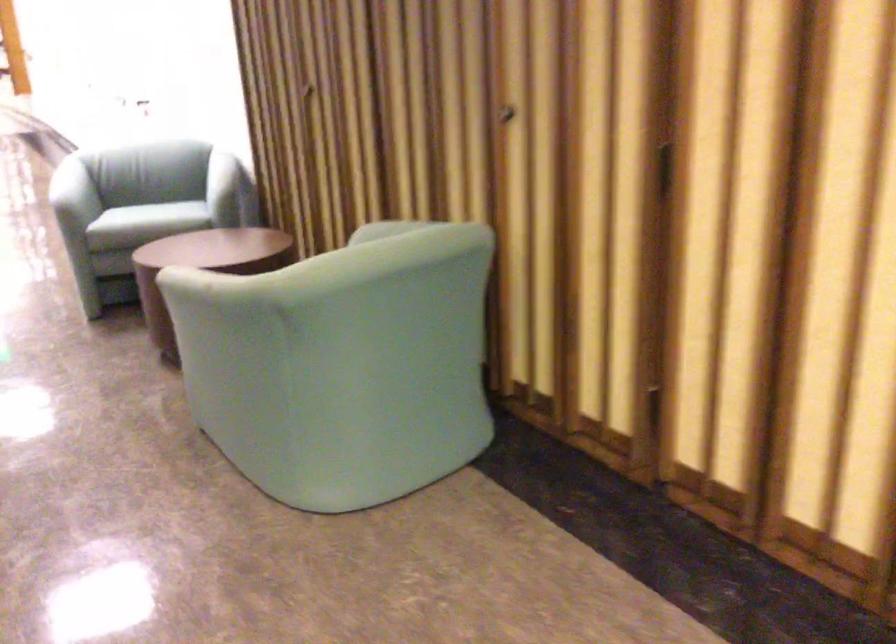
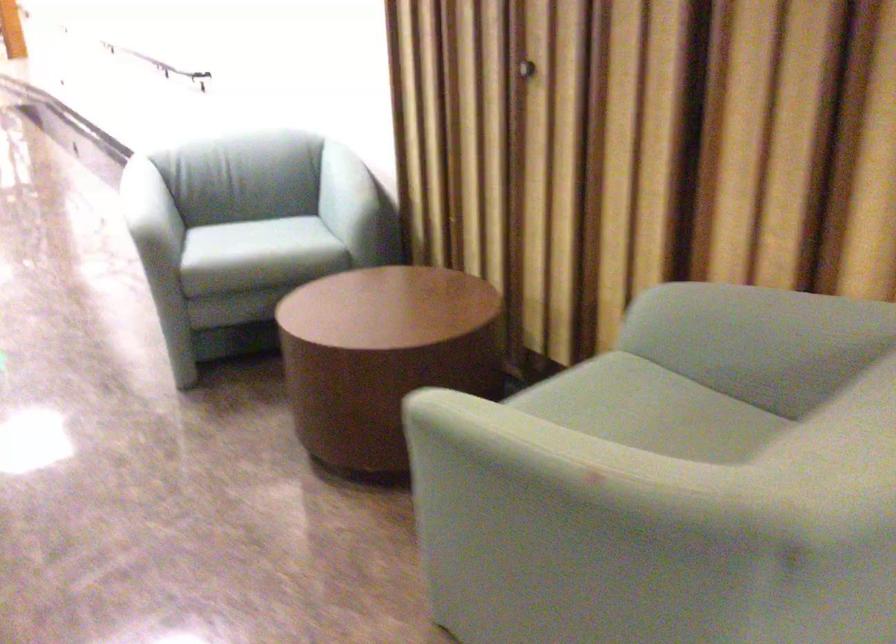
Which direction would the cameraman need to move to produce the second image?

The cameraman walked toward left, forward.